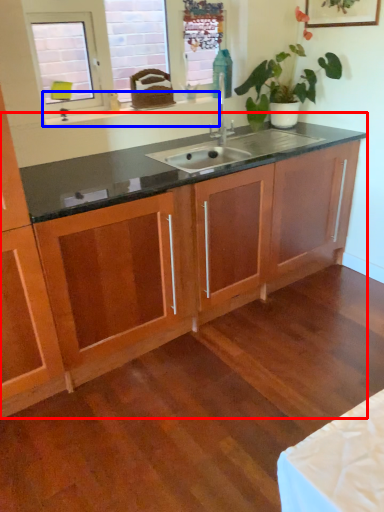
Question: Which object appears farthest to the camera in this image, dresser (highlighted by a red box) or window sill (highlighted by a blue box)?

Choices:
 (A) dresser
 (B) window sill

Answer: (B)